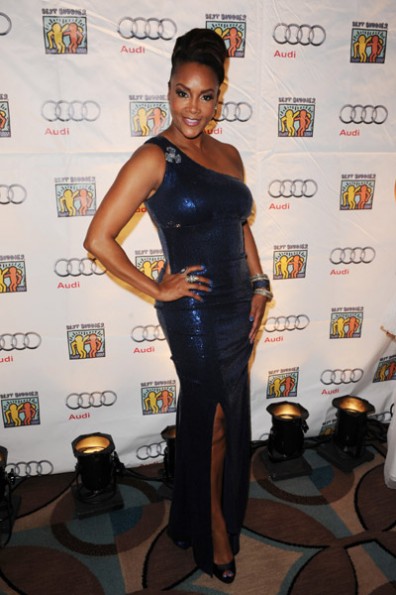
I want to click on light, so click(104, 446), click(5, 455), click(171, 430), click(297, 419), click(360, 410).